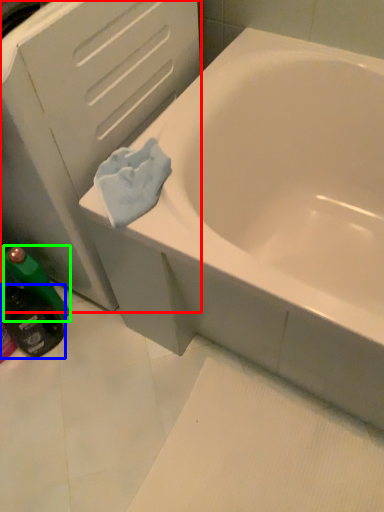
Question: Based on their relative distances, which object is farther from file cabinet (highlighted by a red box)? Choose from mouthwash (highlighted by a blue box) and mouthwash (highlighted by a green box).

Choices:
 (A) mouthwash
 (B) mouthwash

Answer: (A)